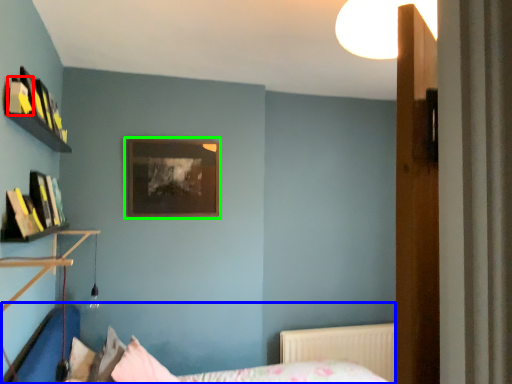
Question: Which object is the farthest from book (highlighted by a red box)? Choose among these: bed (highlighted by a blue box) or picture frame (highlighted by a green box).

Choices:
 (A) bed
 (B) picture frame

Answer: (A)